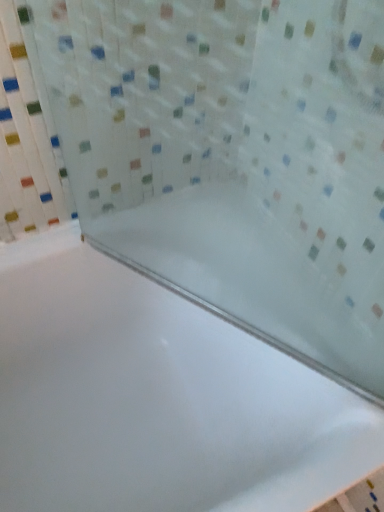
In order to click on white glossy bathtub at center in this screenshot , I will do `click(156, 398)`.

What do you see at coordinates (156, 398) in the screenshot? The width and height of the screenshot is (384, 512). I see `white glossy bathtub at center` at bounding box center [156, 398].

At what (x,y) coordinates should I click in order to perform the action: click on white glossy bathtub at center. Please return your answer as a coordinate pair (x, y). Looking at the image, I should click on (156, 398).